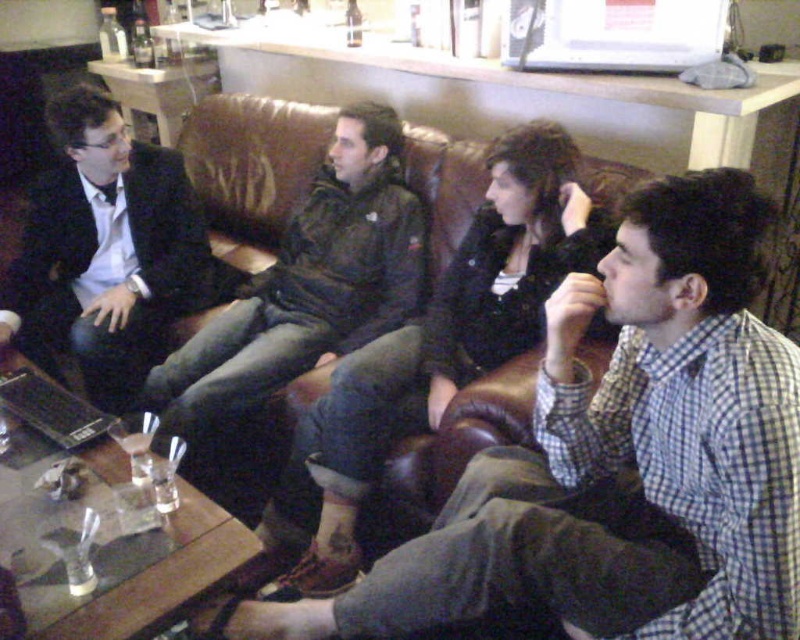
You are a delivery person who needs to place a 28 inch long package between the leather jacket at center and the black plastic laptop at lower left. Is there enough space?

The distance between the leather jacket at center and the black plastic laptop at lower left is 31.75 inches, so yes, the 28 inch package can fit in the available space.

You are standing in the center of the room and want to place a new lamp on the floor. The lamp has a base that is 0.3 meters in diameter. The leather jacket at center is currently located at coordinates point 0.717, 0.777. Will placing the lamp at point 0.7, 0.75 interfere with the jacket?

The leather jacket at center is located at point [621,458]. Placing the lamp at point [600,448] would be very close but not exactly overlapping. However, since the lamp base is 0.3 meters in diameter, the distance between the two points needs to be calculated to ensure they donot overlap. The distance between the points is sqrt of squared differences in coordinates. Let me compute that. The difference in x is 0.717 minus 0.7 equals 0.017. The difference in y is 0.777 minus 0.75 equals 0.027. Squaring and

You are a photographer trying to capture a clear shot of both the matte black suit at left and the dark green jacket at center. Since the camera can only focus on one subject at a time, which item should you focus on to ensure the other is still somewhat in focus?

The matte black suit at left is positioned over dark green jacket at center, so focusing on the matte black suit at left will keep the dark green jacket at center in better focus due to its closer proximity to the camera.